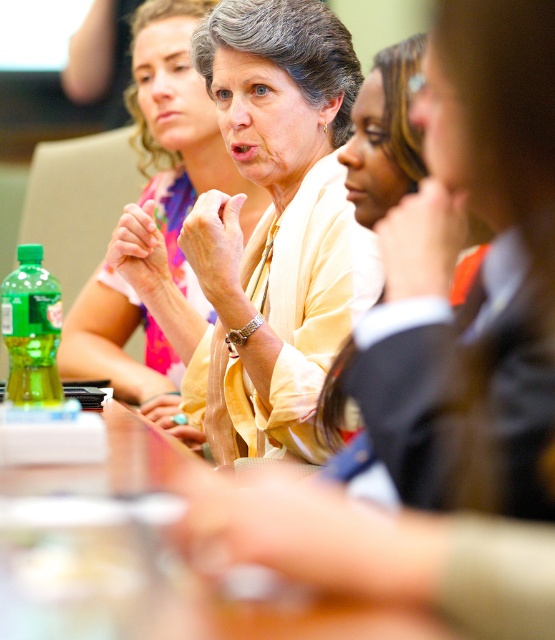
Is yellow satin blouse at center wider than clear plastic bottle at center?

No.

Does yellow satin blouse at center appear on the right side of clear plastic bottle at center?

Correct, you'll find yellow satin blouse at center to the right of clear plastic bottle at center.

Is point (215, 10) more distant than point (391, 605)?

Yes, point (215, 10) is behind point (391, 605).

Where is `yellow satin blouse at center`? yellow satin blouse at center is located at coordinates (275, 225).

Does yellow satin blouse at center come behind matte yellow blouse at center?

No, yellow satin blouse at center is closer to the viewer.

Between point (241, 387) and point (204, 148), which one is positioned in front?

Positioned in front is point (241, 387).

Describe the element at coordinates (275, 225) in the screenshot. I see `yellow satin blouse at center` at that location.

Find the location of a particular element. This screenshot has height=640, width=555. yellow satin blouse at center is located at coordinates (275, 225).

Is clear plastic bottle at center smaller than matte yellow blouse at center?

Yes, clear plastic bottle at center is smaller than matte yellow blouse at center.

Find the location of `clear plastic bottle at center`. clear plastic bottle at center is located at coordinates (139, 557).